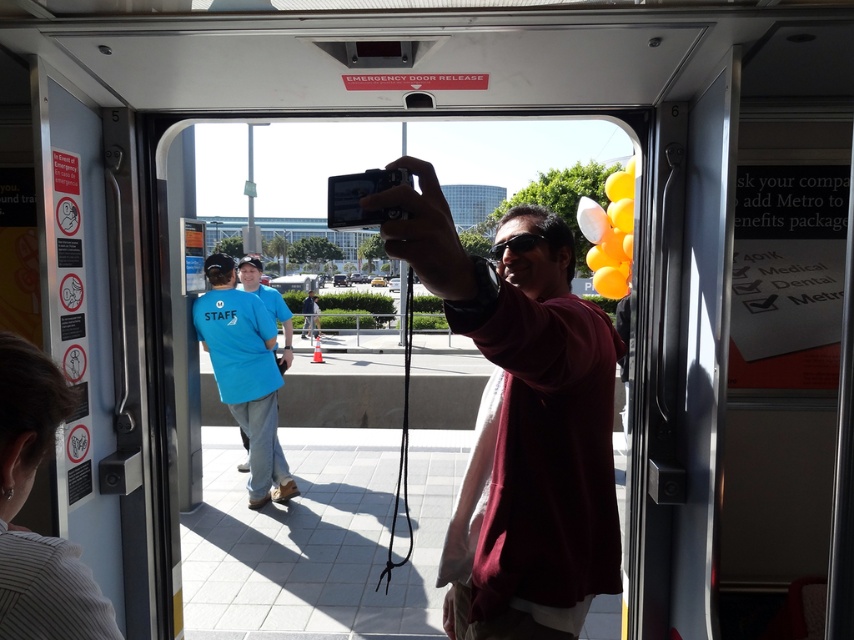
Between point (600, 536) and point (407, 179), which one is positioned behind?

The point (600, 536) is more distant.

Does matte black camera at center have a lesser width compared to black plastic camera at center?

In fact, matte black camera at center might be wider than black plastic camera at center.

Who is more distant from viewer, (539, 492) or (367, 170)?

The point (539, 492) is more distant.

This screenshot has width=854, height=640. In order to click on matte black camera at center in this screenshot , I will do click(x=525, y=417).

Is the position of transparent glass door at center more distant than that of black plastic camera at center?

Yes, it is behind black plastic camera at center.

Does transparent glass door at center have a smaller size compared to black plastic camera at center?

No, transparent glass door at center is not smaller than black plastic camera at center.

Find the location of a particular element. This screenshot has width=854, height=640. transparent glass door at center is located at coordinates (341, 396).

Which is more to the left, matte black camera at center or transparent glass door at center?

transparent glass door at center is more to the left.

Consider the image. Is matte black camera at center behind transparent glass door at center?

That is False.

Is point (569, 234) less distant than point (208, 196)?

Yes, it is in front of point (208, 196).

Where is `matte black camera at center`? Image resolution: width=854 pixels, height=640 pixels. matte black camera at center is located at coordinates (525, 417).